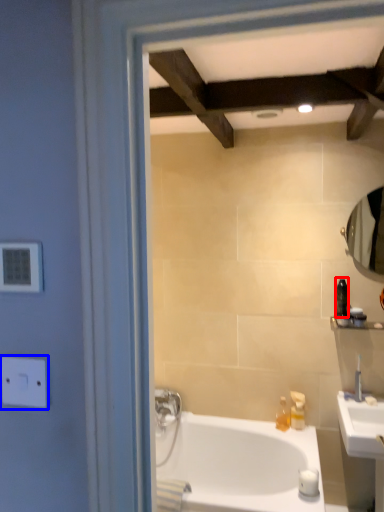
Question: Which of the following is the farthest to the observer, toiletry (highlighted by a red box) or electric outlet (highlighted by a blue box)?

Choices:
 (A) toiletry
 (B) electric outlet

Answer: (A)